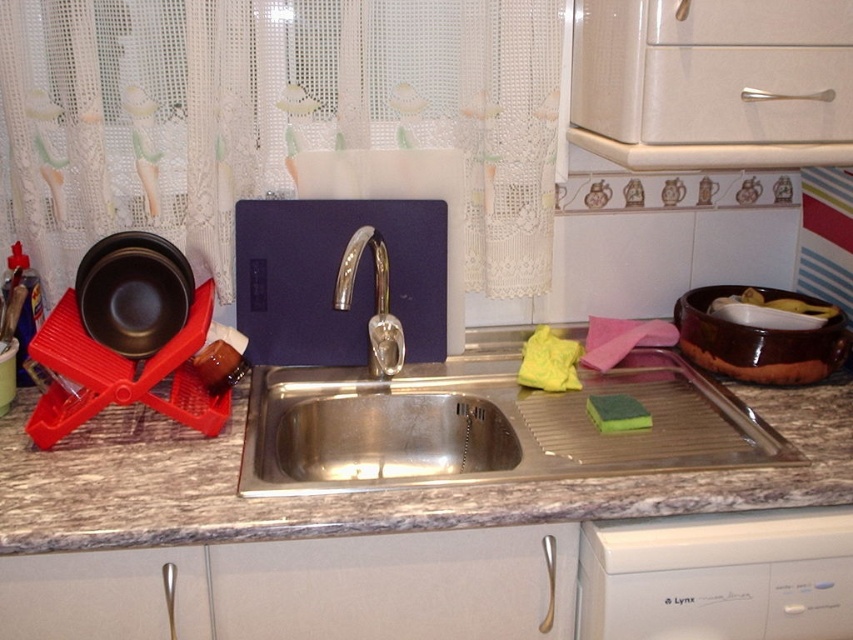
Can you confirm if white plastic dishwasher at lower right is positioned to the right of yellow sponge at sink?

Yes, white plastic dishwasher at lower right is to the right of yellow sponge at sink.

Who is more forward, (x=727, y=584) or (x=560, y=348)?

Point (x=727, y=584) is in front.

What are the coordinates of `white plastic dishwasher at lower right` in the screenshot? It's located at (718, 577).

Based on the photo, does granite countertop at center have a smaller size compared to green sponge at sink?

Incorrect, granite countertop at center is not smaller in size than green sponge at sink.

Measure the distance between granite countertop at center and camera.

granite countertop at center is 37.37 inches from camera.

The height and width of the screenshot is (640, 853). Find the location of `granite countertop at center`. granite countertop at center is located at coordinates (367, 492).

Who is more forward, (4, 440) or (573, 380)?

Point (4, 440) is in front.

Consider the image. Who is higher up, granite countertop at center or yellow sponge at sink?

yellow sponge at sink is above.

Locate an element on the screen. The image size is (853, 640). granite countertop at center is located at coordinates (367, 492).

Locate an element on the screen. The image size is (853, 640). granite countertop at center is located at coordinates (367, 492).